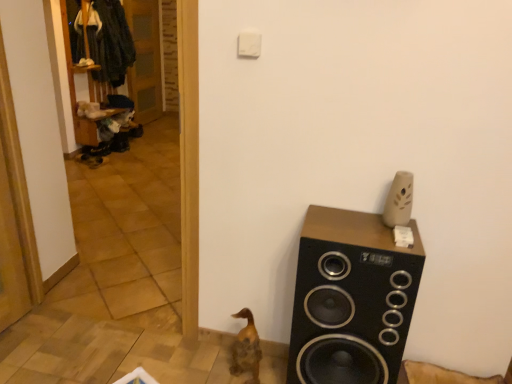
Identify the location of vacant area situated to the left side of brown wooden duck at lower center. The image size is (512, 384). (204, 369).